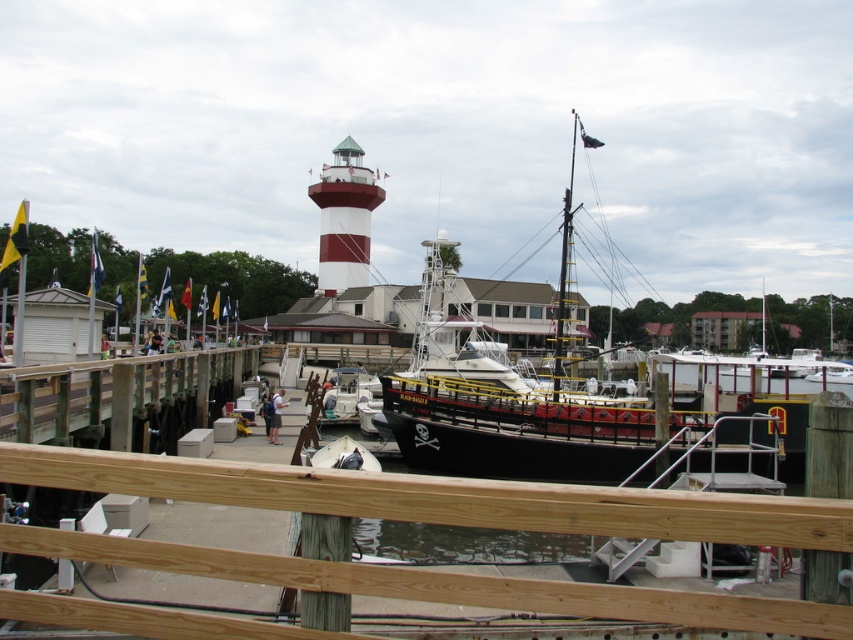
Is black matte pirate ship at center above white fabric shirt at center?

Yes.

From the picture: Does black matte pirate ship at center come in front of white fabric shirt at center?

Yes, black matte pirate ship at center is closer to the viewer.

Locate an element on the screen. This screenshot has width=853, height=640. black matte pirate ship at center is located at coordinates (596, 420).

Between black matte pirate ship at center and blue fabric shirt at center, which one is positioned lower?

Positioned lower is blue fabric shirt at center.

Consider the image. Does black matte pirate ship at center have a lesser height compared to blue fabric shirt at center?

No.

Who is more forward, (482, 417) or (273, 406)?

Point (482, 417) is more forward.

Locate an element on the screen. The width and height of the screenshot is (853, 640). black matte pirate ship at center is located at coordinates (596, 420).

Does white fabric shirt at center have a lesser width compared to blue fabric shirt at center?

Incorrect, white fabric shirt at center's width is not less than blue fabric shirt at center's.

Which is behind, point (283, 404) or point (271, 396)?

The point (283, 404) is behind.

Where is `white fabric shirt at center`? white fabric shirt at center is located at coordinates (276, 416).